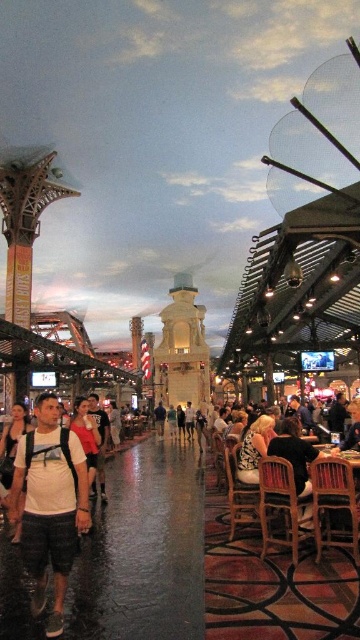
Does white cotton shirt at center come in front of matte black backpack at center?

That is True.

Which is behind, point (86, 419) or point (105, 500)?

Positioned behind is point (86, 419).

Find the location of a particular element. white cotton shirt at center is located at coordinates (86, 435).

Which is below, dark brown leather chair at lower right or matte black backpack at center?

Positioned lower is matte black backpack at center.

Does dark brown leather chair at lower right come behind matte black backpack at center?

No.

Does point (309, 524) come in front of point (102, 496)?

Yes, it is in front of point (102, 496).

Where is `dark brown leather chair at lower right`? The image size is (360, 640). dark brown leather chair at lower right is located at coordinates (297, 464).

Find the location of a particular element. This screenshot has height=640, width=360. dark brown leather chair at lower right is located at coordinates (297, 464).

Is dark brown leather chair at lower right shorter than white cotton shirt at center?

Yes, dark brown leather chair at lower right is shorter than white cotton shirt at center.

Is point (290, 419) farther from viewer compared to point (78, 403)?

No.

Image resolution: width=360 pixels, height=640 pixels. What are the coordinates of `dark brown leather chair at lower right` in the screenshot? It's located at (297, 464).